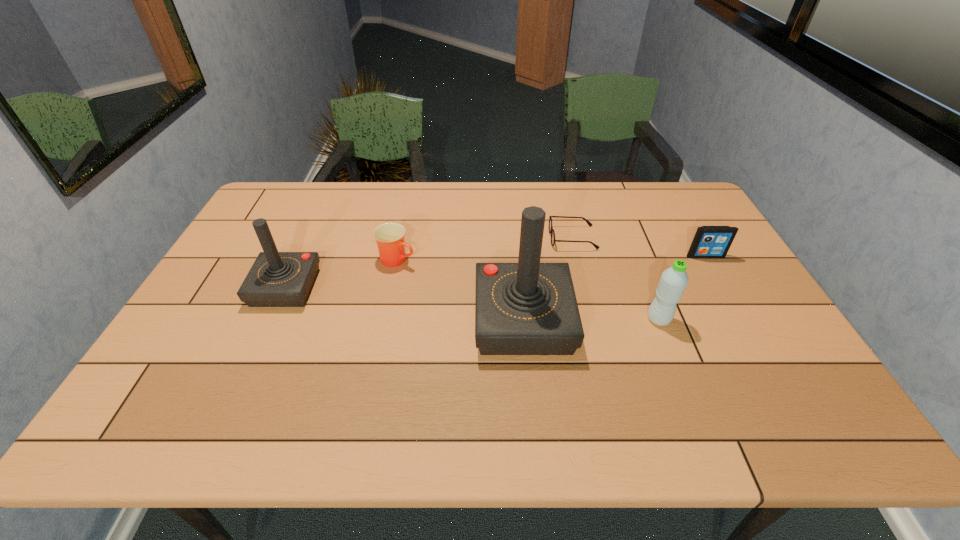
The width and height of the screenshot is (960, 540). I want to click on the left joystick, so click(276, 279).

Where is `the leftmost object`? The height and width of the screenshot is (540, 960). the leftmost object is located at coordinates (276, 279).

At what (x,y) coordinates should I click in order to perform the action: click on the tallest object. Please return your answer as a coordinate pair (x, y). Looking at the image, I should click on (527, 308).

Locate an element on the screen. the taller joystick is located at coordinates (527, 308).

Find the location of a particular element. cup is located at coordinates (390, 237).

Image resolution: width=960 pixels, height=540 pixels. What are the coordinates of `spectacles` in the screenshot? It's located at (551, 230).

At what (x,y) coordinates should I click in order to perform the action: click on the fifth object from left to right. Please return your answer as a coordinate pair (x, y). Looking at the image, I should click on (673, 281).

You are a GUI agent. You are given a task and a screenshot of the screen. Output one action in this format:
    pyautogui.click(x=<x>, y=<y>)
    Task: Click on the water bottle
    Image resolution: width=960 pixels, height=540 pixels.
    Given the screenshot: What is the action you would take?
    pyautogui.click(x=673, y=281)

I want to click on the rightmost object, so click(709, 241).

This screenshot has width=960, height=540. Identify the location of blank area located on the rectangular base of the shorter joystick. (225, 287).